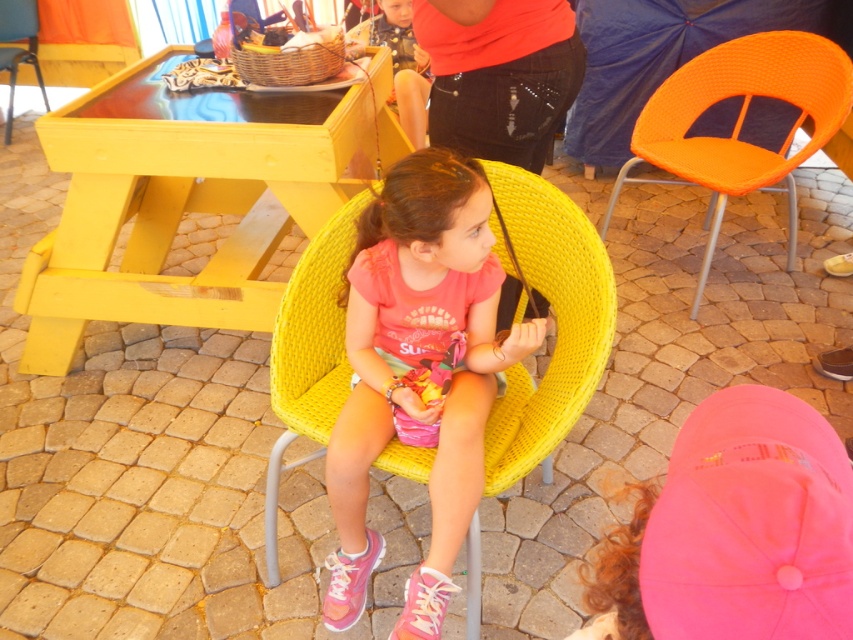
Does yellow wicker chair at center have a lesser width compared to yellow woven chair at upper left?

No, yellow wicker chair at center is not thinner than yellow woven chair at upper left.

Between point (329, 410) and point (1, 13), which one is positioned behind?

Point (1, 13)

Between point (566, 256) and point (6, 26), which one is positioned behind?

The point (6, 26) is more distant.

The image size is (853, 640). Identify the location of yellow wicker chair at center. tap(556, 324).

Between yellow wicker chair at center and orange woven umbrella at upper right, which one has more height?

yellow wicker chair at center

Locate an element on the screen. yellow wicker chair at center is located at coordinates (556, 324).

What do you see at coordinates (556, 324) in the screenshot?
I see `yellow wicker chair at center` at bounding box center [556, 324].

The height and width of the screenshot is (640, 853). What are the coordinates of `yellow wicker chair at center` in the screenshot? It's located at (556, 324).

Does pink fabric cap at lower right have a lesser height compared to yellow wicker chair at center?

Yes.

Is point (805, 536) positioned before point (592, 340)?

Yes, point (805, 536) is closer to viewer.

Who is more distant from viewer, (x=809, y=417) or (x=498, y=428)?

The point (x=498, y=428) is behind.

Where is `pink fabric cap at lower right`? pink fabric cap at lower right is located at coordinates (733, 531).